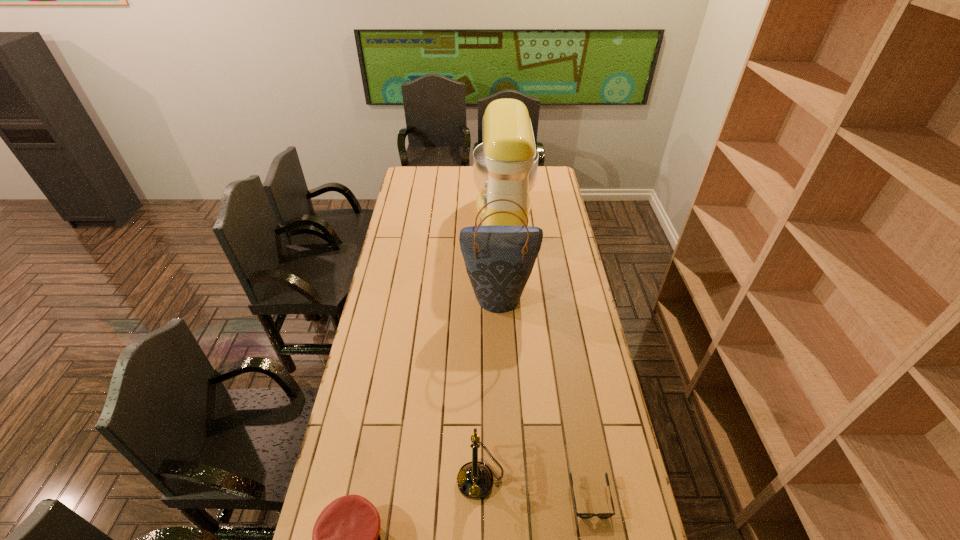
The width and height of the screenshot is (960, 540). Find the location of `vacant space located 0.080m on the dial of the telephone`. vacant space located 0.080m on the dial of the telephone is located at coordinates (430, 478).

The width and height of the screenshot is (960, 540). Find the location of `free space located 0.370m on the dial of the telephone`. free space located 0.370m on the dial of the telephone is located at coordinates pyautogui.click(x=334, y=478).

Image resolution: width=960 pixels, height=540 pixels. Find the location of `free space located on the dial of the telephone`. free space located on the dial of the telephone is located at coordinates (341, 478).

The height and width of the screenshot is (540, 960). I want to click on mixer situated at the right edge, so click(505, 165).

The image size is (960, 540). I want to click on sunglasses that is at the right edge, so click(581, 515).

Identify the location of free spot at the left edge of the desktop. The width and height of the screenshot is (960, 540). (348, 439).

At what (x,y) coordinates should I click in order to perform the action: click on free space at the right edge of the desktop. Please return your answer as a coordinate pair (x, y). This screenshot has width=960, height=540. Looking at the image, I should click on (583, 346).

The width and height of the screenshot is (960, 540). Identify the location of vacant region at the far left corner of the desktop. (431, 171).

Locate an element on the screen. vacant region between the sunglasses and the third shortest object is located at coordinates (536, 488).

Locate an element on the screen. This screenshot has height=540, width=960. free point between the third tallest object and the second tallest object is located at coordinates (490, 387).